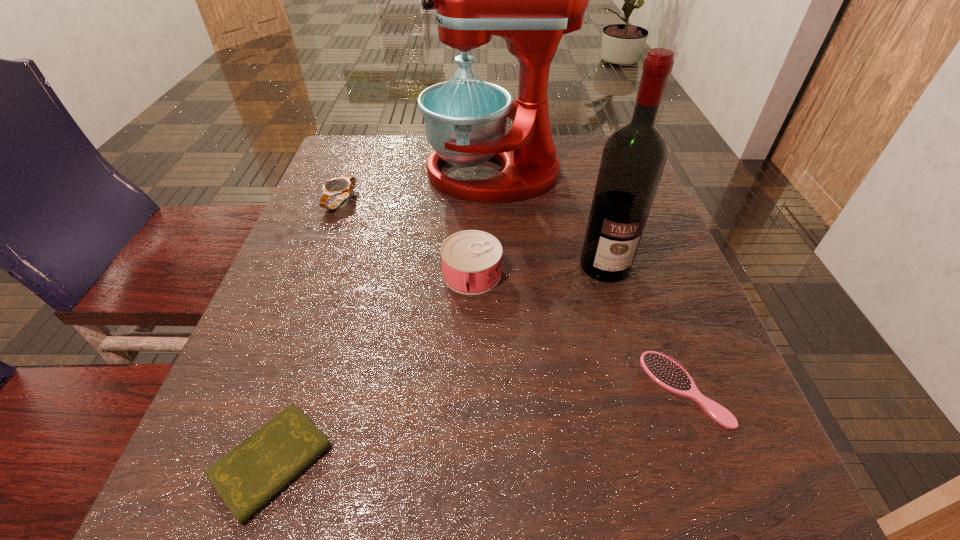
Locate an element on the screen. The image size is (960, 540). free location that satisfies the following two spatial constraints: 1. on the front-facing side of the mixer; 2. on the back side of the hairbrush is located at coordinates [x=503, y=389].

Where is `vacant space that satisfies the following two spatial constraints: 1. on the front-facing side of the mixer; 2. on the front side of the can`? This screenshot has width=960, height=540. vacant space that satisfies the following two spatial constraints: 1. on the front-facing side of the mixer; 2. on the front side of the can is located at coordinates (498, 274).

Find the location of a particular element. This screenshot has height=540, width=960. vacant position in the image that satisfies the following two spatial constraints: 1. on the front-facing side of the hairbrush; 2. on the right side of the mixer is located at coordinates (503, 389).